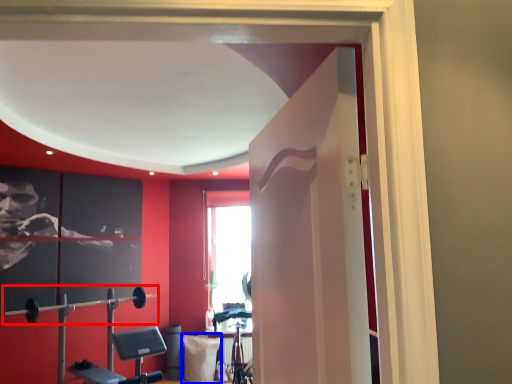
Question: Which of the following is the farthest to the observer, barbell (highlighted by a red box) or pillow (highlighted by a blue box)?

Choices:
 (A) barbell
 (B) pillow

Answer: (B)